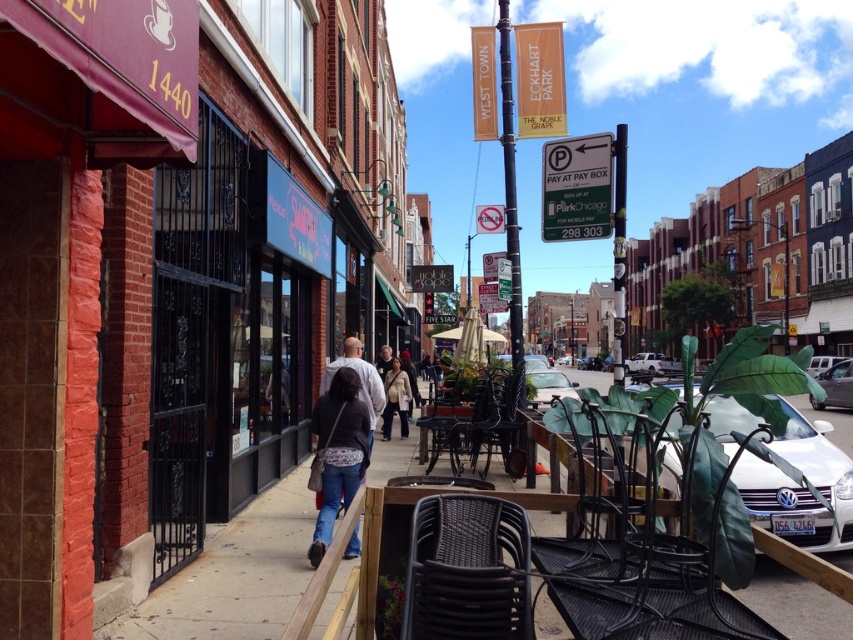
Can you confirm if denim pants at center is shorter than black metal chair at center?

Incorrect, denim pants at center's height does not fall short of black metal chair at center's.

Is denim pants at center smaller than black metal chair at center?

Yes, denim pants at center is smaller than black metal chair at center.

Who is more forward, [325,504] or [436,422]?

Point [325,504]

Find the location of a particular element. denim pants at center is located at coordinates (338, 452).

Based on the photo, can you confirm if denim pants at center is shorter than metallic black chair at center?

In fact, denim pants at center may be taller than metallic black chair at center.

Is denim pants at center below metallic black chair at center?

Indeed, denim pants at center is positioned under metallic black chair at center.

This screenshot has width=853, height=640. What do you see at coordinates (338, 452) in the screenshot?
I see `denim pants at center` at bounding box center [338, 452].

At what (x,y) coordinates should I click in order to perform the action: click on denim pants at center. Please return your answer as a coordinate pair (x, y). The height and width of the screenshot is (640, 853). Looking at the image, I should click on (338, 452).

How distant is smooth concrete sidewalk at center from metallic black chair at center?

smooth concrete sidewalk at center and metallic black chair at center are 4.48 feet apart.

Is point (276, 573) positioned before point (495, 376)?

Yes, it is.

Find the location of a particular element. The height and width of the screenshot is (640, 853). smooth concrete sidewalk at center is located at coordinates (234, 576).